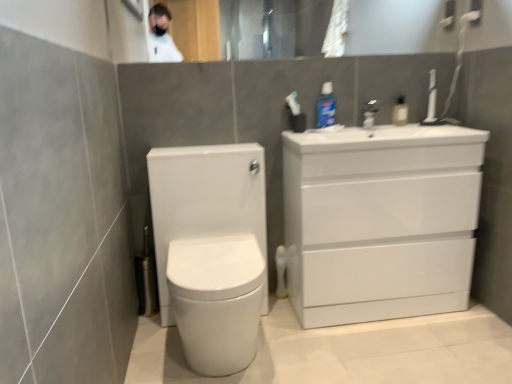
I want to click on free area in between satin nickel faucet at upper center and blue glossy mouthwash at upper center, the 1th toiletry when ordered from left to right, so click(x=352, y=124).